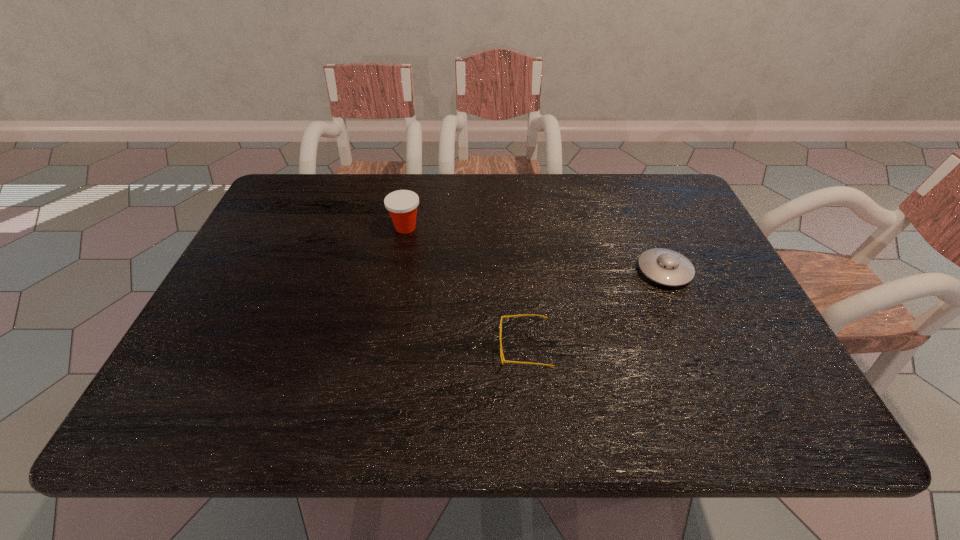
The image size is (960, 540). Identify the location of free space that satisfies the following two spatial constraints: 1. on the front side of the rightmost object; 2. on the left side of the Dixie cup. (397, 271).